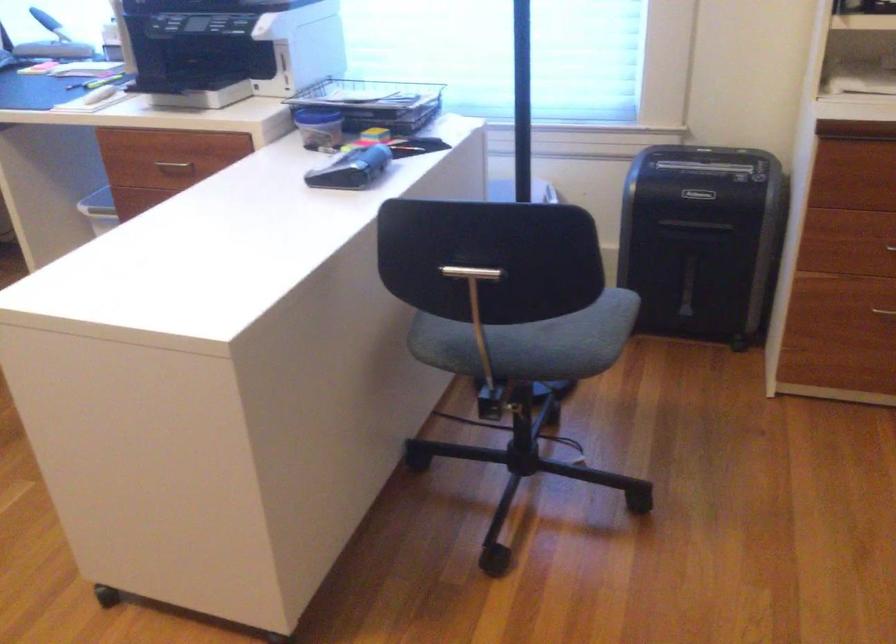
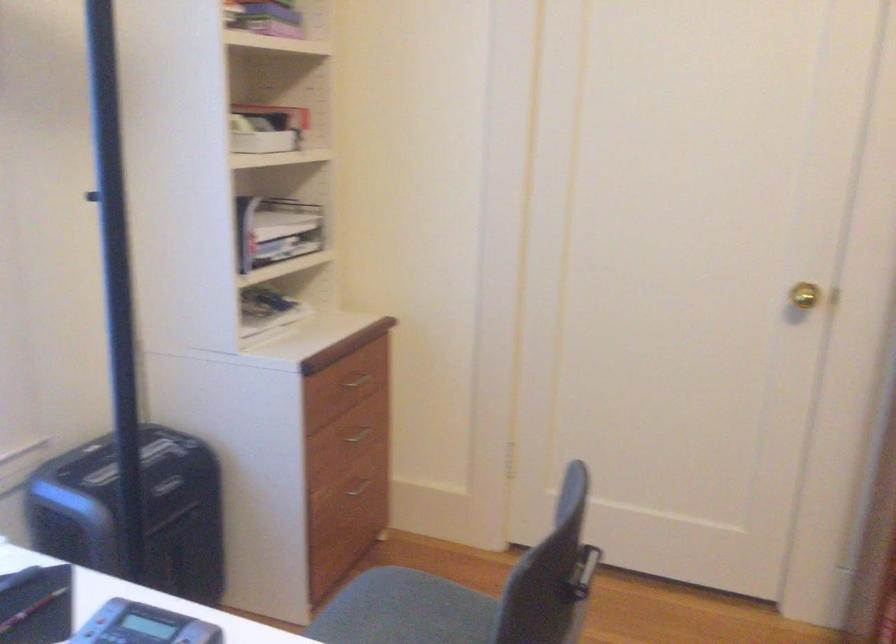
Find the pixel in the second image that matches point (607, 327) in the first image.

(405, 611)